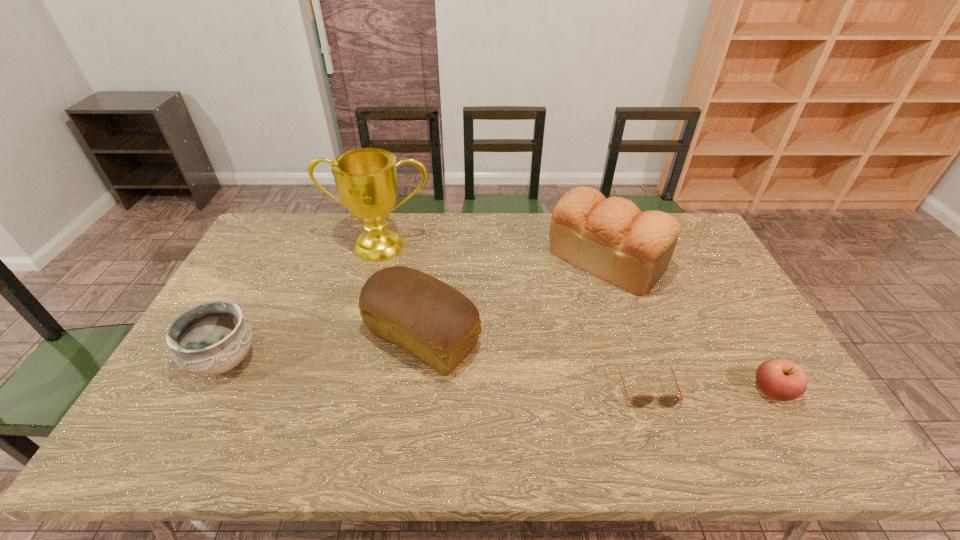
You are a GUI agent. You are given a task and a screenshot of the screen. Output one action in this format:
    pyautogui.click(x=<x>, y=<y>)
    Task: Click on the vacant area that satisfies the following two spatial constraints: 1. on the shiny surface of the tallest object; 2. on the left side of the apple
    Image resolution: width=960 pixels, height=540 pixels.
    Given the screenshot: What is the action you would take?
    pyautogui.click(x=342, y=392)